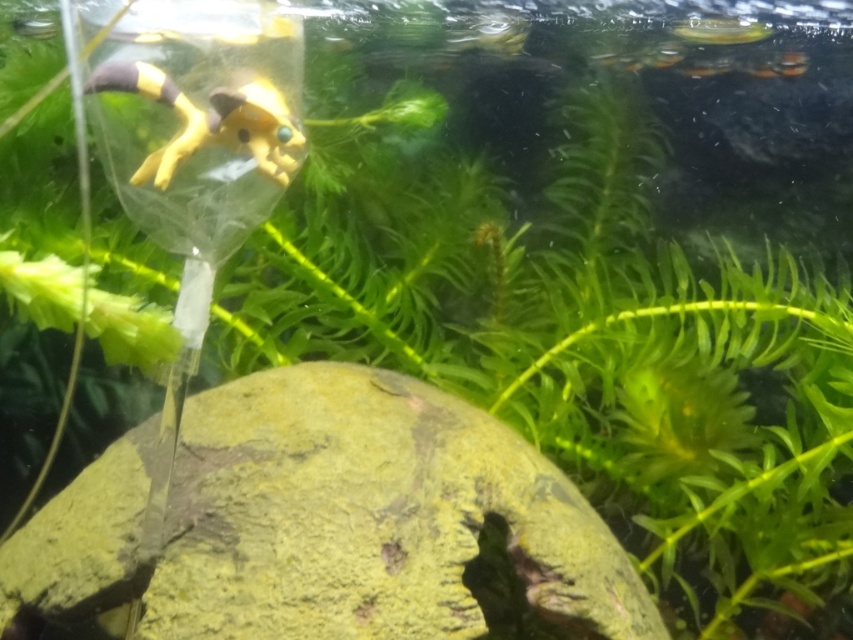
Question: Does yellow matte toy at upper left appear over translucent plastic fish at upper right?

Choices:
 (A) no
 (B) yes

Answer: (A)

Question: Among these objects, which one is farthest from the camera?

Choices:
 (A) green mossy rock at center
 (B) translucent plastic fish at upper right

Answer: (B)

Question: Can you confirm if green mossy rock at center is positioned to the left of yellow matte toy at upper left?

Choices:
 (A) yes
 (B) no

Answer: (B)

Question: Which point is closer to the camera?

Choices:
 (A) translucent plastic fish at upper right
 (B) green mossy rock at center
 (C) yellow matte toy at upper left

Answer: (B)

Question: Is yellow matte toy at upper left wider than translucent plastic fish at upper right?

Choices:
 (A) yes
 (B) no

Answer: (A)

Question: Which point is closer to the camera?

Choices:
 (A) green mossy rock at center
 (B) yellow matte toy at upper left

Answer: (A)